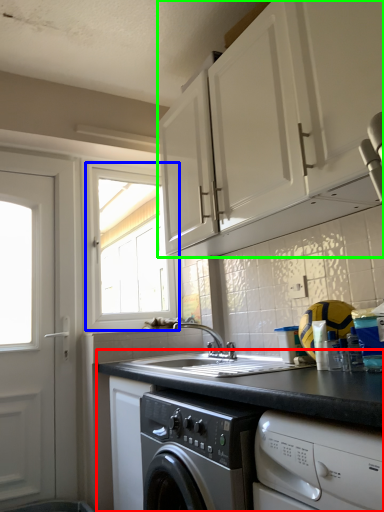
Question: Which object is the closest to the countertop (highlighted by a red box)? Choose among these: window (highlighted by a blue box) or cabinetry (highlighted by a green box).

Choices:
 (A) window
 (B) cabinetry

Answer: (B)